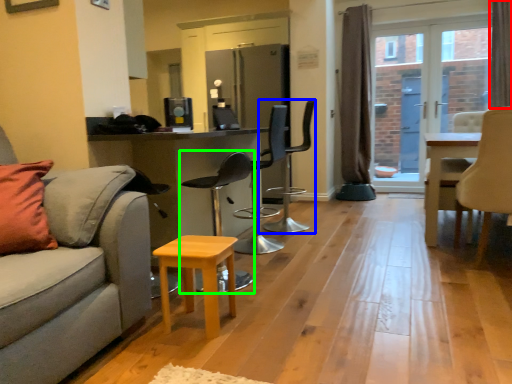
Question: Based on their relative distances, which object is farther from curtain (highlighted by a red box)? Choose from chair (highlighted by a blue box) and chair (highlighted by a green box).

Choices:
 (A) chair
 (B) chair

Answer: (B)